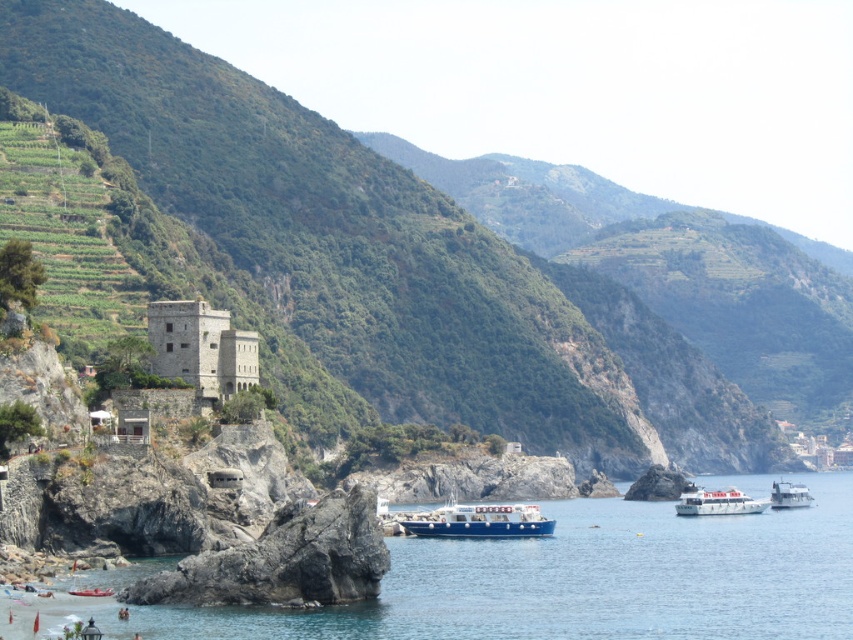
You are a photographer planning to capture the entire scene in one shot. Given that the white glossy ferry at center is smaller than the clear blue water at lower left, which object should you focus on first to ensure both are in frame?

The clear blue water at lower left is larger in size than the white glossy ferry at center, so you should focus on capturing the clear blue water at lower left first to ensure it fits within the frame, then adjust to include the smaller white glossy ferry at center.

You are a photographer planning to capture both the white glossy ferry at center and the white glossy boat at lower right in a single shot. Based on their sizes in the image, which one do you think will appear smaller?

The white glossy ferry at center occupies less space than the white glossy boat at lower right, so it will appear smaller in the photograph.